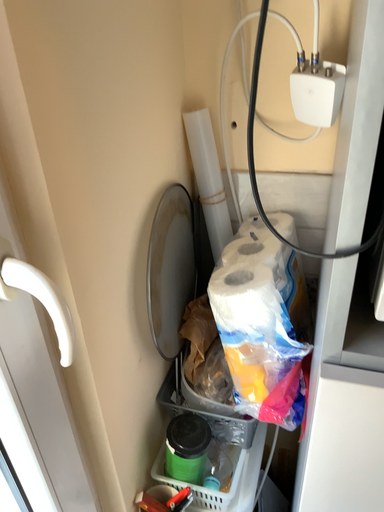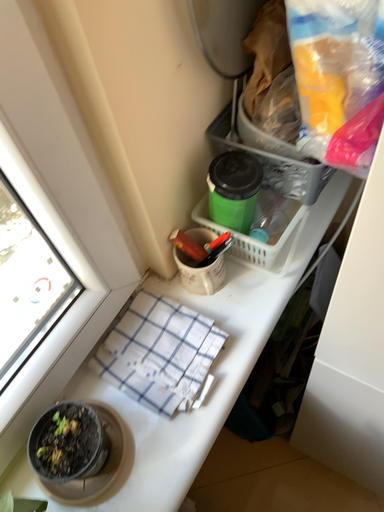
Question: Which way did the camera rotate in the video?

Choices:
 (A) rotated upward
 (B) rotated downward

Answer: (B)